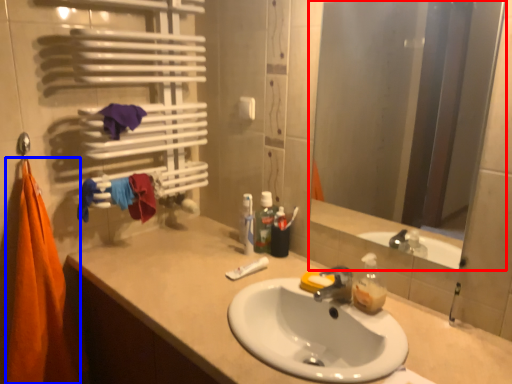
Question: Which object appears farthest to the camera in this image, mirror (highlighted by a red box) or beach towel (highlighted by a blue box)?

Choices:
 (A) mirror
 (B) beach towel

Answer: (B)